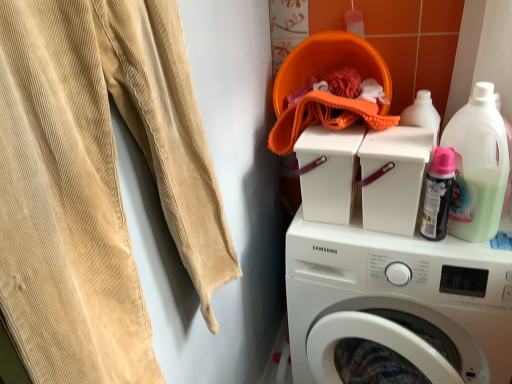
Where is `free point in front of white plastic washing machine at center, acting as the 2th washing machine starting from the bottom`? The image size is (512, 384). free point in front of white plastic washing machine at center, acting as the 2th washing machine starting from the bottom is located at coordinates (354, 243).